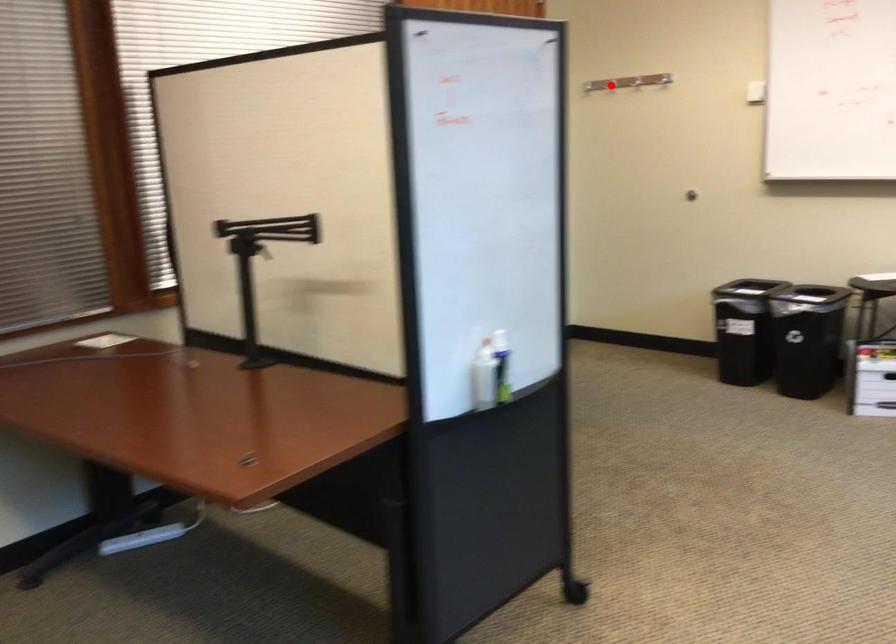
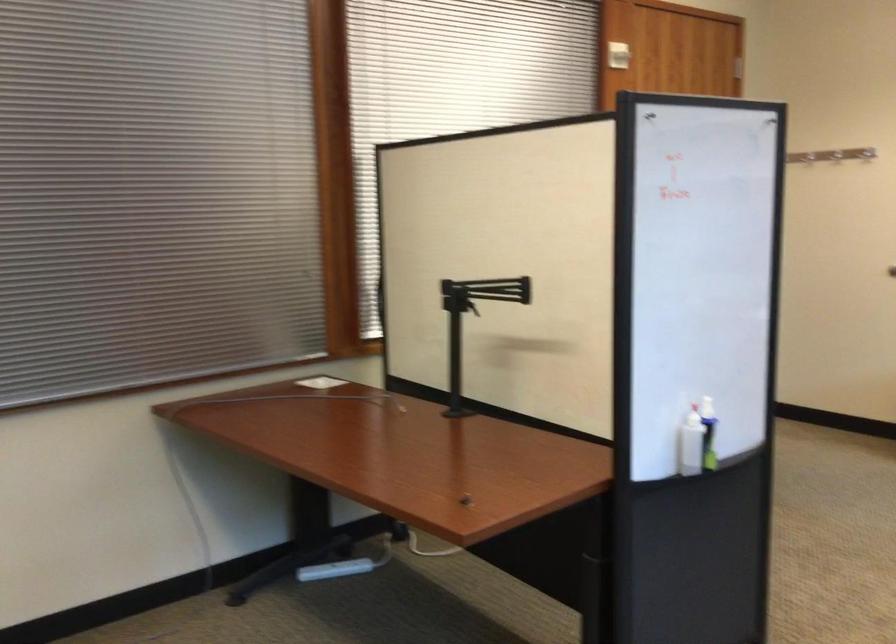
Where in the second image is the point corresponding to the highlighted location from the first image?

(808, 153)